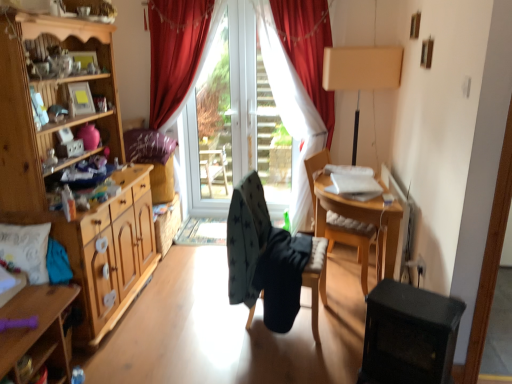
The width and height of the screenshot is (512, 384). I want to click on free space in front of dark gray fabric chair at center, which is the 1th chair in left-to-right order, so click(x=285, y=362).